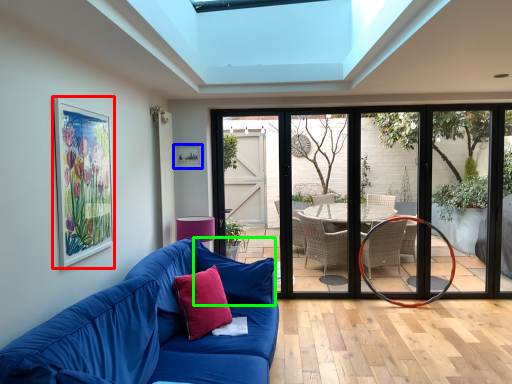
Question: Based on their relative distances, which object is nearer to picture frame (highlighted by a red box)? Choose from picture frame (highlighted by a blue box) and pillow (highlighted by a green box).

Choices:
 (A) picture frame
 (B) pillow

Answer: (B)